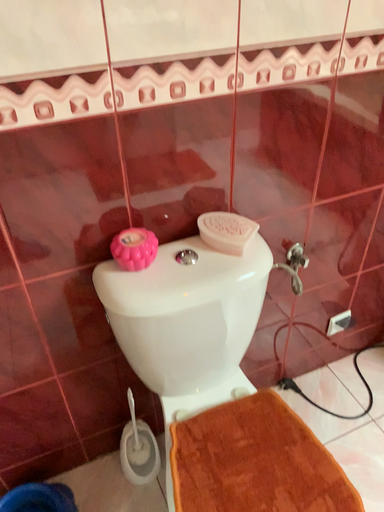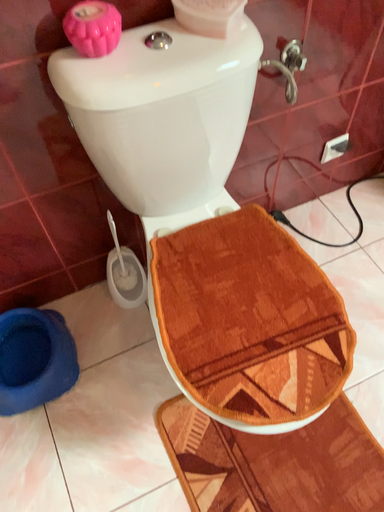
Question: Which way did the camera rotate in the video?

Choices:
 (A) rotated upward
 (B) rotated downward

Answer: (B)